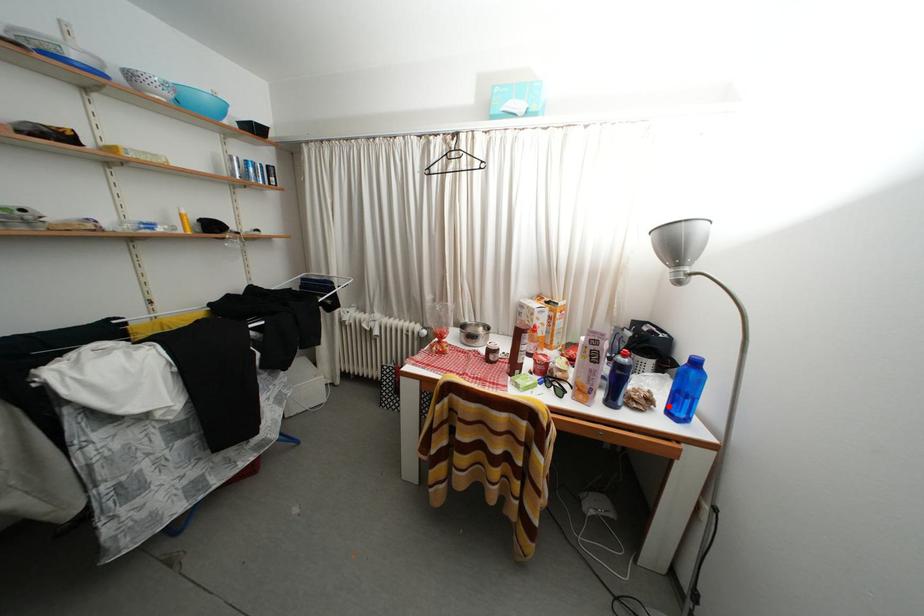
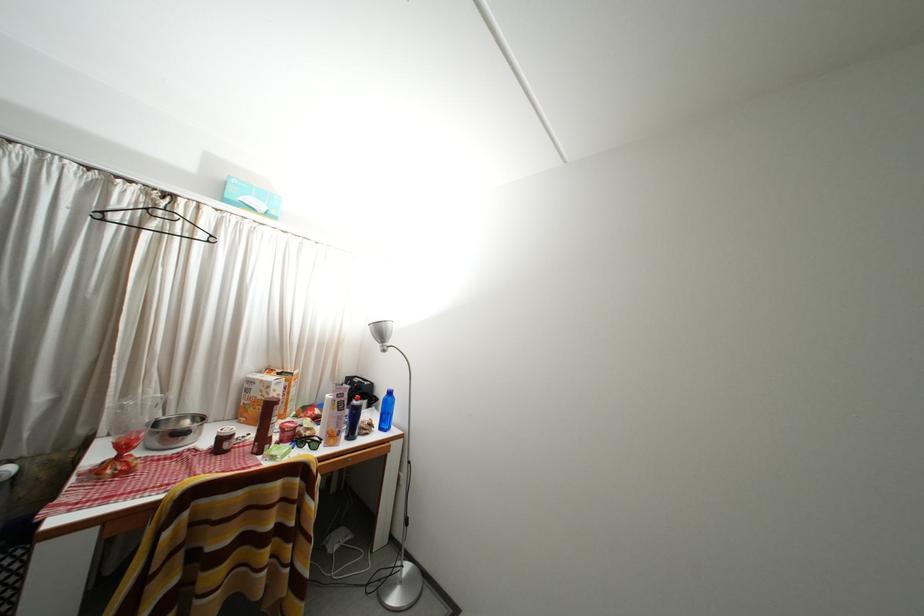
The point at the highlighted location is marked in the first image. Where is the corresponding point in the second image?

(383, 428)